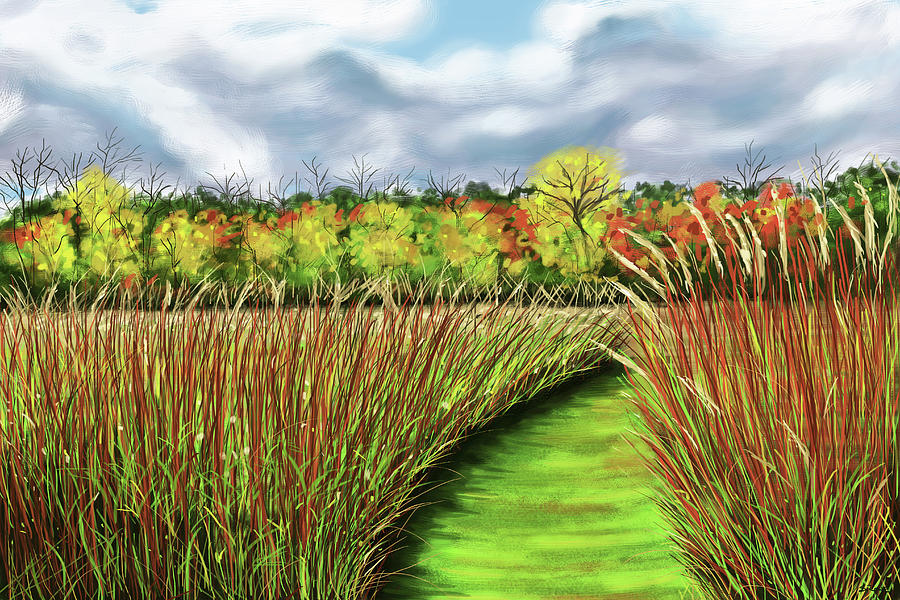
Find the location of a particular element. The height and width of the screenshot is (600, 900). paintings of trees is located at coordinates (113, 254), (157, 253), (240, 252), (292, 254).